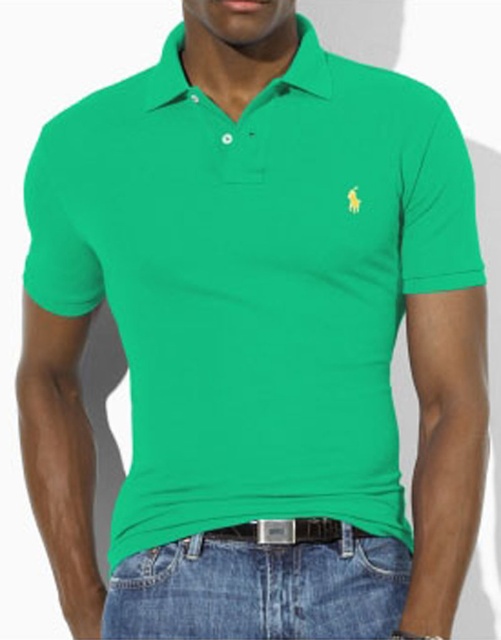
In the scene shown: Is denim jeans at lower center positioned in front of jeans pocket at lower center?

Yes, it is.

Is denim jeans at lower center to the left of jeans pocket at lower center from the viewer's perspective?

No, denim jeans at lower center is not to the left of jeans pocket at lower center.

Between point (197, 637) and point (142, 556), which one is positioned behind?

The point (142, 556) is behind.

Where is `denim jeans at lower center`? This screenshot has height=640, width=501. denim jeans at lower center is located at coordinates (262, 586).